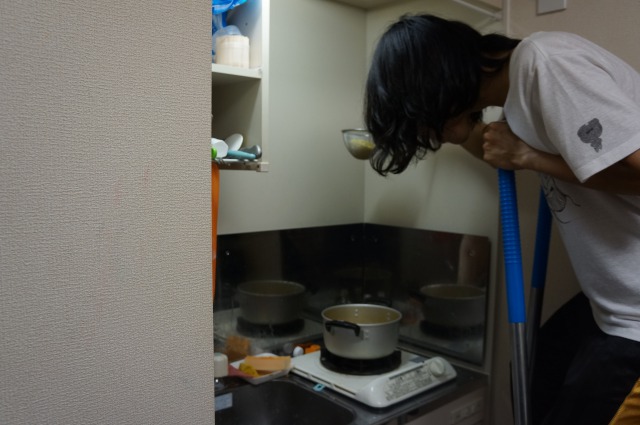
Locate an element on the screen. The image size is (640, 425). cabinet is located at coordinates tap(246, 91).